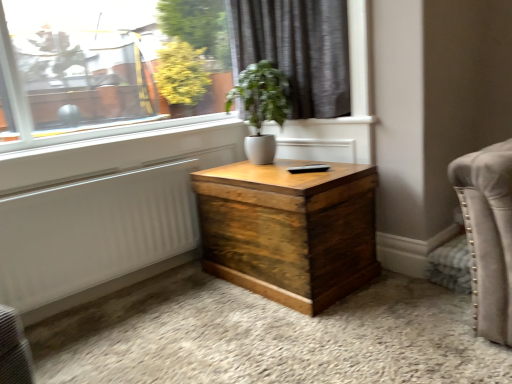
Identify the location of empty space that is ontop of white textured radiator at lower left. Image resolution: width=512 pixels, height=384 pixels. (86, 182).